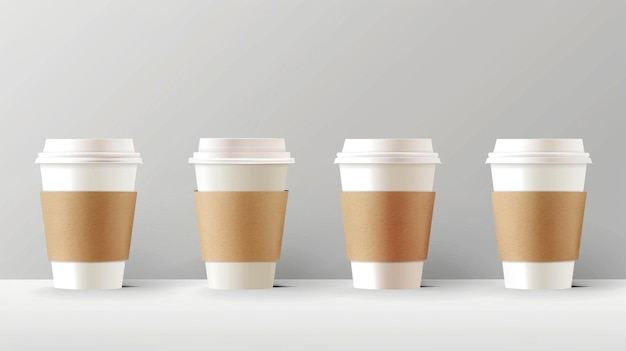
The height and width of the screenshot is (351, 626). I want to click on cup sleeves, so click(109, 207), click(239, 219), click(394, 223), click(533, 213).